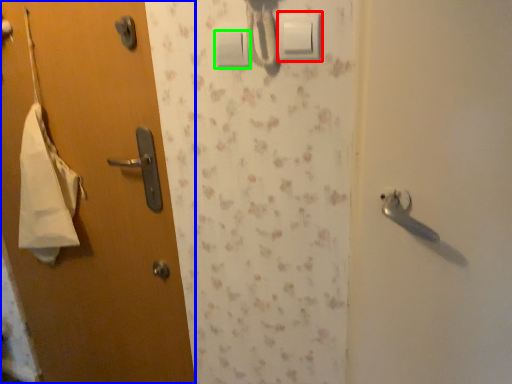
Question: Which is nearer to the light switch (highlighted by a red box)? door (highlighted by a blue box) or light switch (highlighted by a green box).

Choices:
 (A) door
 (B) light switch

Answer: (B)